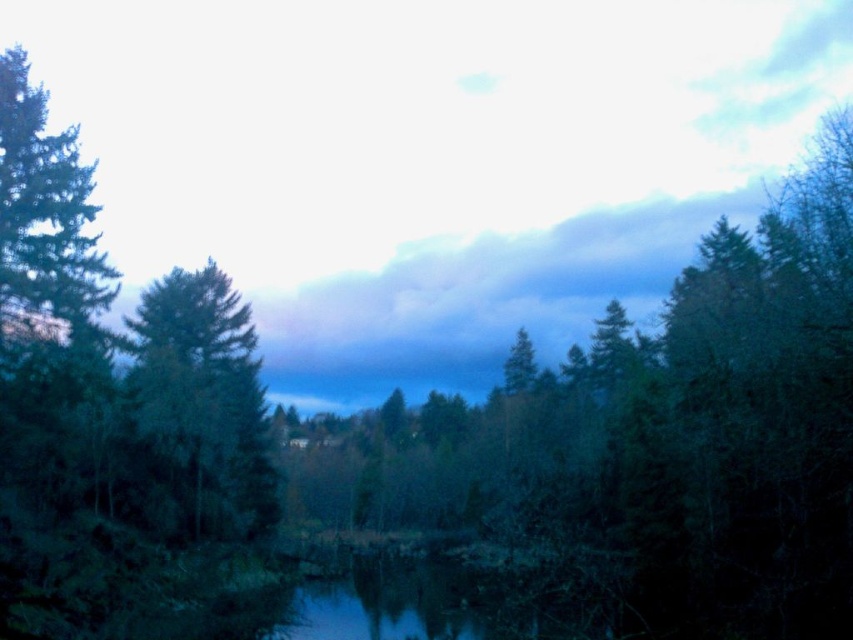
You are standing in the forest and see the green matte tree at center and the green matte tree at left. Which tree is closer to you?

The green matte tree at center is closer to you because it is in front of the green matte tree at left.

You are an environmental scientist assessing a forest area. You observe two trees in the scene. Which tree, the green matte tree at center or the green matte tree at left, has a greater height?

The green matte tree at center has a larger size compared to the green matte tree at left, so it is taller.

You are standing in a forest and want to take a photo of the green matte tree at center. If your camera has a maximum focus range of 20 meters, will you be able to capture the tree clearly?

The green matte tree at center is 18.72 meters away from the camera. Since this distance is within the camera maximum focus range of 20 meters, the tree can be captured clearly.